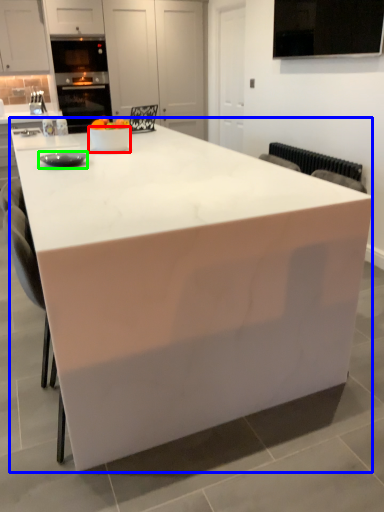
Question: Which object is positioned closest to bowl (highlighted by a red box)? Select from table (highlighted by a blue box) and appliance (highlighted by a green box).

Choices:
 (A) table
 (B) appliance

Answer: (B)